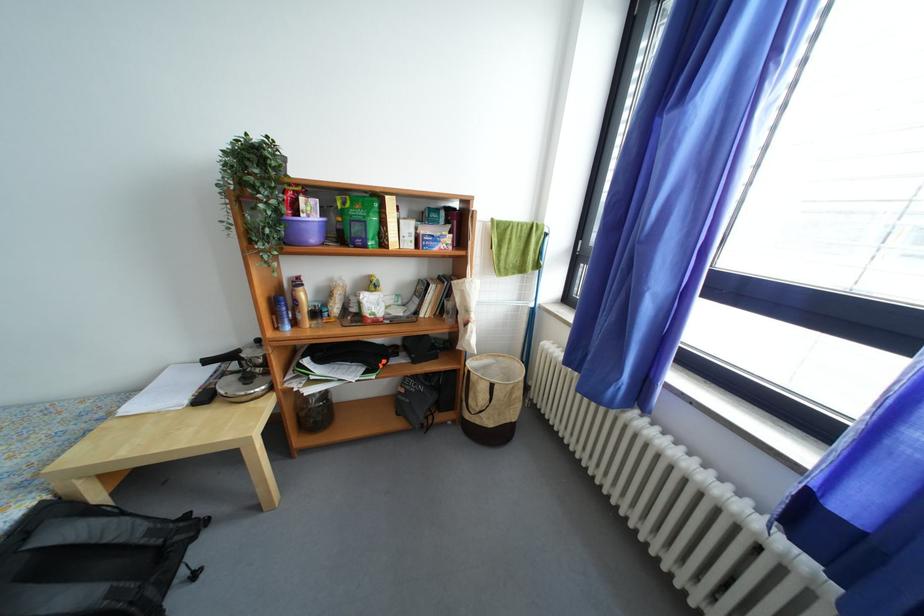
Identify the location of pot lid handle. This screenshot has height=616, width=924. (244, 384).